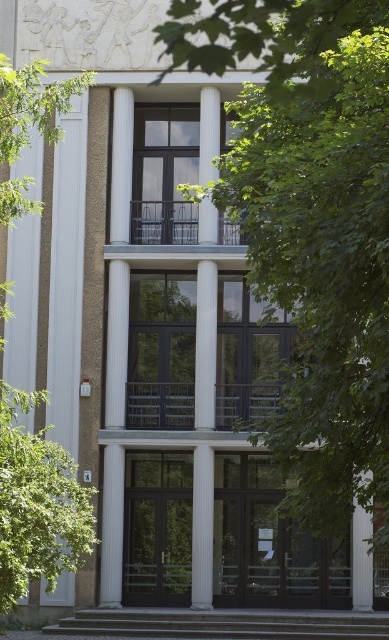
Question: Which is nearer to the white smooth column at center?

Choices:
 (A) concrete stairs at lower center
 (B) white glossy column at center

Answer: (A)

Question: Based on their relative distances, which object is nearer to the white glossy column at center?

Choices:
 (A) green leafy tree at center
 (B) white smooth column at center
 (C) green leafy tree at left

Answer: (B)

Question: Considering the relative positions of green leafy tree at left and white glossy column at center in the image provided, where is green leafy tree at left located with respect to white glossy column at center?

Choices:
 (A) above
 (B) below

Answer: (B)

Question: Does green leafy tree at left have a lesser width compared to white glossy column at center?

Choices:
 (A) yes
 (B) no

Answer: (B)

Question: Can you confirm if green leafy tree at left is positioned above white smooth column at center?

Choices:
 (A) yes
 (B) no

Answer: (A)

Question: Which object is the closest to the white smooth column at center?

Choices:
 (A) white glossy column at center
 (B) green leafy tree at center

Answer: (A)